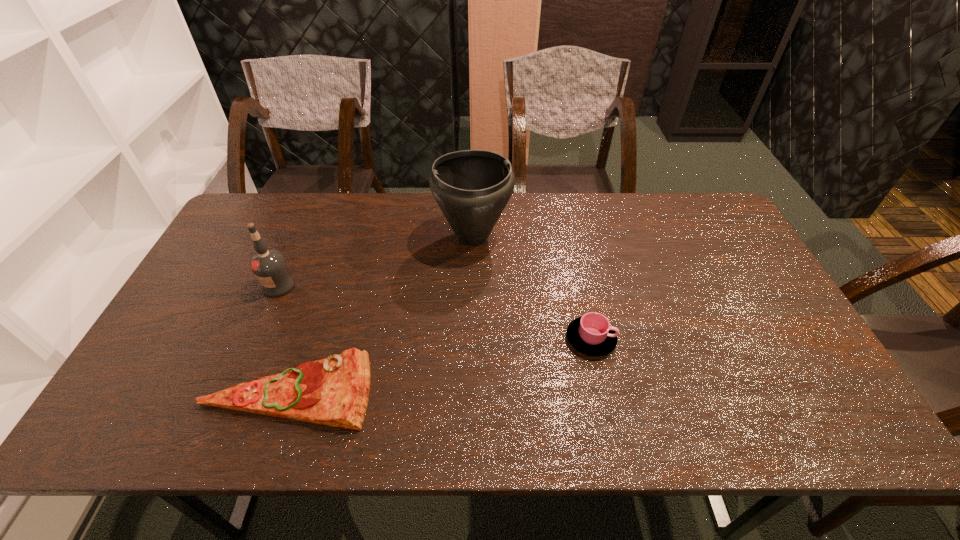
Where is `blank region between the rightmost object and the pizza`? This screenshot has width=960, height=540. blank region between the rightmost object and the pizza is located at coordinates (440, 364).

You are a GUI agent. You are given a task and a screenshot of the screen. Output one action in this format:
    pyautogui.click(x=<x>, y=<y>)
    Task: Click on the unoccupied area between the second tallest object and the pizza
    
    Given the screenshot: What is the action you would take?
    pyautogui.click(x=284, y=338)

Locate an element on the screen. The image size is (960, 540). vacant area that lies between the rightmost object and the pizza is located at coordinates (440, 364).

Where is `vacant space that is in between the pizza and the vodka`? Image resolution: width=960 pixels, height=540 pixels. vacant space that is in between the pizza and the vodka is located at coordinates (284, 338).

Find the location of a particular element. vacant space in between the vodka and the rightmost object is located at coordinates (435, 313).

You are a GUI agent. You are given a task and a screenshot of the screen. Output one action in this format:
    pyautogui.click(x=<x>, y=<y>)
    Task: Click on the unoccupied area between the third object from left to right and the second tallest object
    Image resolution: width=960 pixels, height=540 pixels.
    Given the screenshot: What is the action you would take?
    pyautogui.click(x=376, y=261)

The height and width of the screenshot is (540, 960). What are the coordinates of `object that is the second nearest to the pizza` in the screenshot? It's located at (472, 187).

Point out which object is positioned as the nearest to the urn. Please provide its 2D coordinates. Your answer should be formatted as a tuple, i.e. [(x, y)], where the tuple contains the x and y coordinates of a point satisfying the conditions above.

[(592, 335)]

Find the location of a particular element. free space that satisfies the following two spatial constraints: 1. on the front label of the pizza; 2. on the right side of the third shortest object is located at coordinates (234, 389).

Locate an element on the screen. Image resolution: width=960 pixels, height=540 pixels. vacant region that satisfies the following two spatial constraints: 1. on the front label of the third shortest object; 2. on the right side of the pizza is located at coordinates coord(234,389).